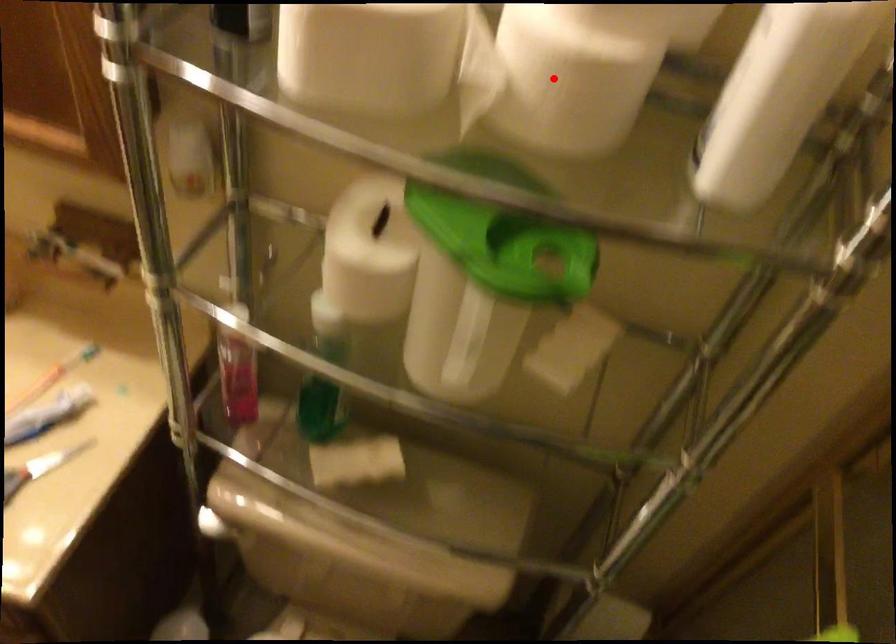
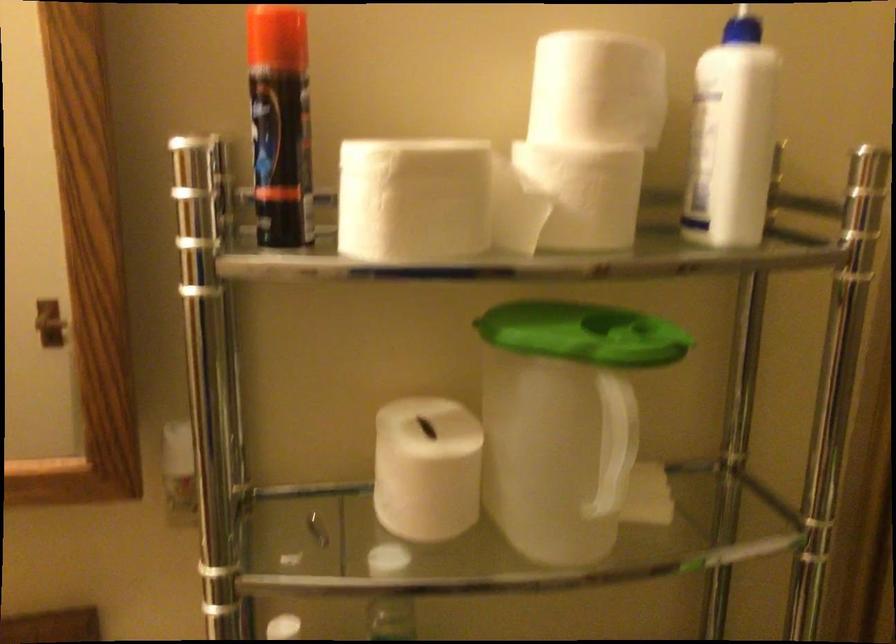
Locate, in the second image, the point that corresponds to the highlighted location in the first image.

(588, 194)